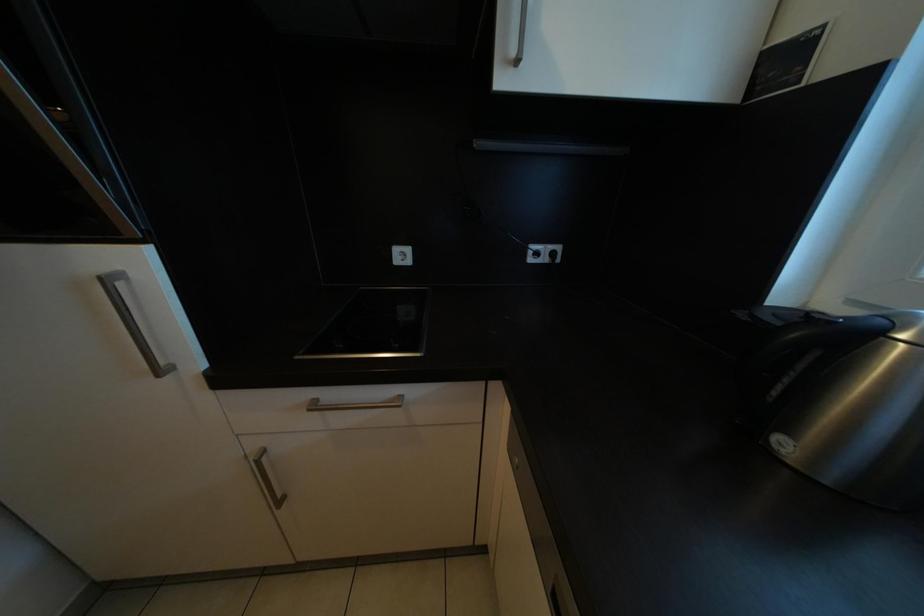
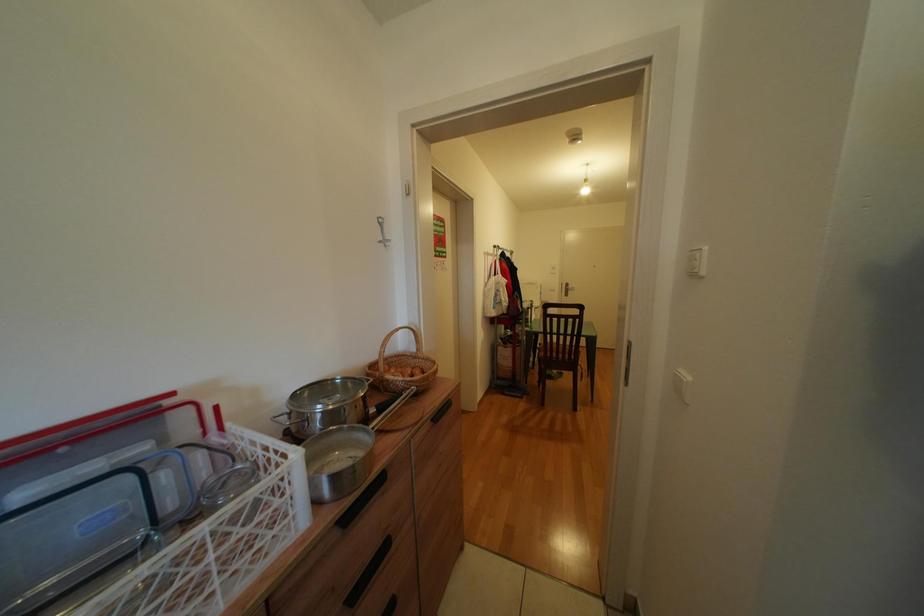
The first image is from the beginning of the video and the second image is from the end. How did the camera likely rotate when shooting the video?

The camera's rotation is toward left-down.